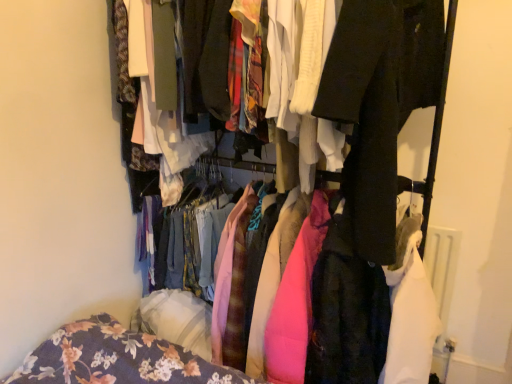
What do you see at coordinates (433, 133) in the screenshot? This screenshot has width=512, height=384. I see `matte black coat at center` at bounding box center [433, 133].

Locate an element on the screen. This screenshot has width=512, height=384. matte black coat at center is located at coordinates (433, 133).

Locate an element on the screen. The image size is (512, 384). matte black coat at center is located at coordinates (433, 133).